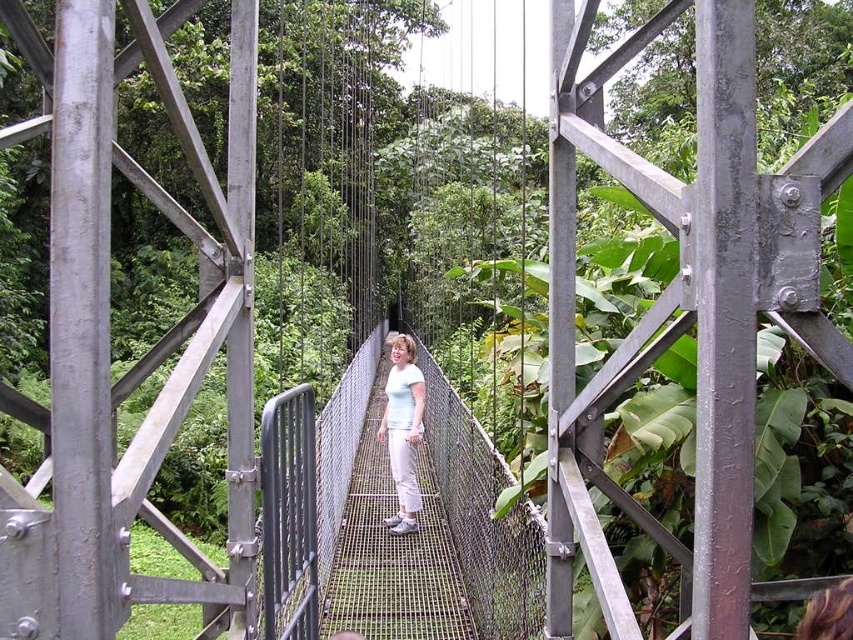
You are a photographer trying to capture the entire metal mesh rope bridge at center and white matte pants at center in one frame. Which object should you focus on first to ensure both are in the frame?

The metal mesh rope bridge at center is larger in size than the white matte pants at center, so you should focus on the metal mesh rope bridge at center first to ensure both fit within the frame.

You are a photographer trying to capture the metal mesh rope bridge at center and the white matte pants at center in a single frame. Which object should you focus on first to ensure both are in the frame without needing to adjust the camera angle?

The metal mesh rope bridge at center is shorter than the white matte pants at center, so you should focus on the white matte pants at center first to ensure both are included in the frame without needing to adjust the camera angle.

You are a photographer trying to capture the person on the metal mesh rope bridge at center and their white matte pants at center. Based on their positions, which object would appear closer to the camera in the photo?

The metal mesh rope bridge at center is in front of the white matte pants at center, so the metal mesh rope bridge at center would appear closer to the camera in the photo.